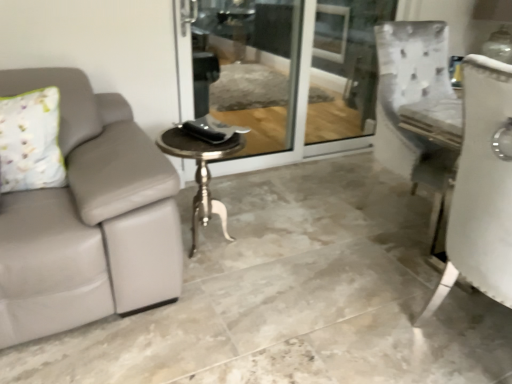
I want to click on free area below polished silver table at center (from a real-world perspective), so click(214, 246).